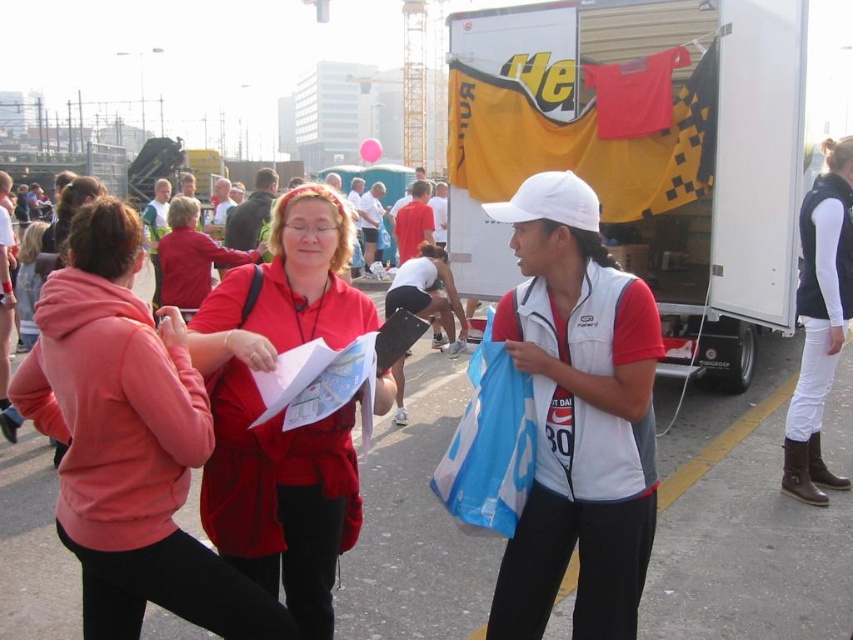
Between white matte vest at center and matte red jacket at center, which one appears on the left side from the viewer's perspective?

From the viewer's perspective, matte red jacket at center appears more on the left side.

This screenshot has height=640, width=853. I want to click on white matte vest at center, so click(x=577, y=416).

Who is positioned more to the right, matte red hoodie at center or matte red jacket at center?

From the viewer's perspective, matte red jacket at center appears more on the right side.

Can you confirm if matte red hoodie at center is smaller than matte red jacket at center?

No.

Measure the distance between matte red hoodie at center and camera.

matte red hoodie at center is 6.96 feet from camera.

Find the location of a particular element. The image size is (853, 640). matte red hoodie at center is located at coordinates click(x=129, y=442).

This screenshot has height=640, width=853. Identify the location of matte red hoodie at center. (129, 442).

Does matte red hoodie at center have a smaller size compared to white matte vest at center?

Incorrect, matte red hoodie at center is not smaller in size than white matte vest at center.

Is point (112, 276) farther from camera compared to point (659, 314)?

No, (112, 276) is closer to viewer.

In order to click on matte red hoodie at center in this screenshot , I will do `click(129, 442)`.